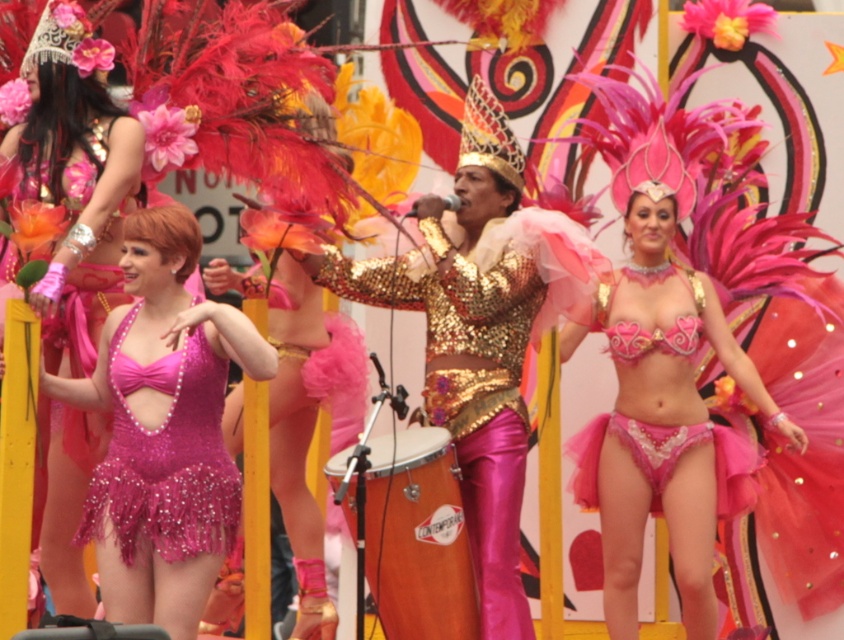
Question: Observing the image, what is the correct spatial positioning of shiny gold sequins at center in reference to shiny sequined dress at center?

Choices:
 (A) left
 (B) right

Answer: (B)

Question: Does shiny gold sequins at center have a smaller size compared to shiny sequined dress at left?

Choices:
 (A) yes
 (B) no

Answer: (B)

Question: Based on their relative distances, which object is farther from the pink sequined bikini at upper left?

Choices:
 (A) shiny gold sequins at center
 (B) pink sequined bikini at center

Answer: (B)

Question: Is pink sequined bikini at upper left thinner than pink sequined bikini at center?

Choices:
 (A) no
 (B) yes

Answer: (B)

Question: Based on their relative distances, which object is nearer to the shiny sequined dress at left?

Choices:
 (A) pink sequined bikini at center
 (B) shiny pink bikini at center

Answer: (B)

Question: Which point appears closest to the camera in this image?

Choices:
 (A) (95, 381)
 (B) (377, 276)
 (C) (688, 276)
 (D) (659, 368)

Answer: (A)